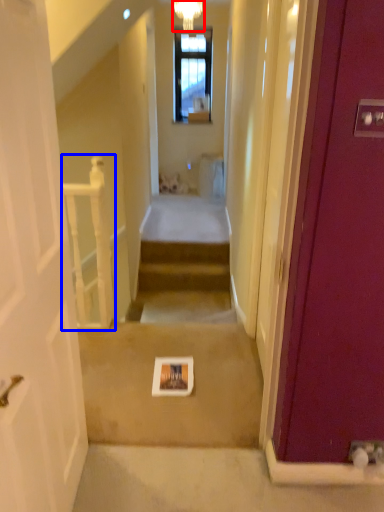
Question: Which of the following is the farthest to the observer, light fixture (highlighted by a red box) or balustrade (highlighted by a blue box)?

Choices:
 (A) light fixture
 (B) balustrade

Answer: (A)